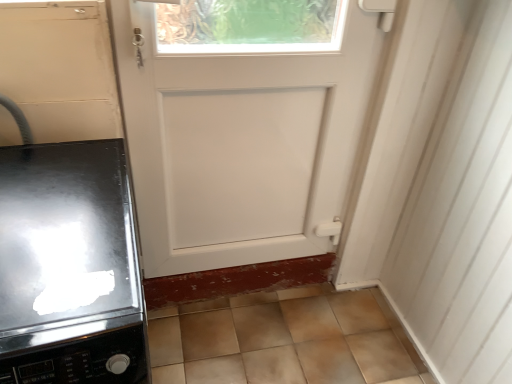
Question: From a real-world perspective, is glossy black stove at left under white matte door at center?

Choices:
 (A) yes
 (B) no

Answer: (A)

Question: From a real-world perspective, is glossy black stove at left positioned over white matte door at center based on gravity?

Choices:
 (A) no
 (B) yes

Answer: (A)

Question: Is white matte door at center at the back of glossy black stove at left?

Choices:
 (A) yes
 (B) no

Answer: (B)

Question: Does glossy black stove at left appear on the right side of white matte door at center?

Choices:
 (A) no
 (B) yes

Answer: (A)

Question: Would you say white matte door at center is part of glossy black stove at left's contents?

Choices:
 (A) no
 (B) yes

Answer: (A)

Question: From the image's perspective, is glossy black stove at left on white matte door at center?

Choices:
 (A) yes
 (B) no

Answer: (B)

Question: Can you confirm if white matte door at center is taller than glossy black stove at left?

Choices:
 (A) yes
 (B) no

Answer: (A)

Question: Considering the relative positions of white matte door at center and glossy black stove at left in the image provided, is white matte door at center to the right of glossy black stove at left from the viewer's perspective?

Choices:
 (A) yes
 (B) no

Answer: (A)

Question: Is white matte door at center surrounding glossy black stove at left?

Choices:
 (A) no
 (B) yes

Answer: (A)

Question: Can you confirm if white matte door at center is wider than glossy black stove at left?

Choices:
 (A) no
 (B) yes

Answer: (A)

Question: Can you confirm if white matte door at center is thinner than glossy black stove at left?

Choices:
 (A) yes
 (B) no

Answer: (A)

Question: Is white matte door at center further to the viewer compared to glossy black stove at left?

Choices:
 (A) no
 (B) yes

Answer: (B)

Question: Does point (285, 66) appear closer or farther from the camera than point (12, 203)?

Choices:
 (A) closer
 (B) farther

Answer: (B)